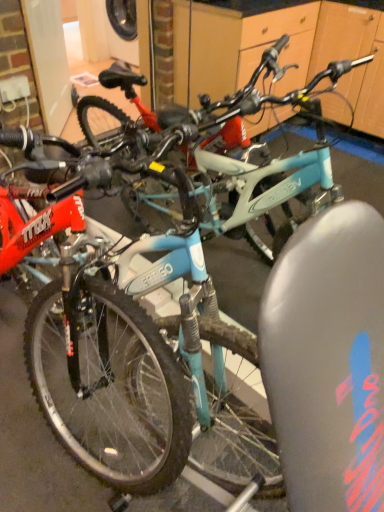
Measure the distance between point (208,167) and camera.

Point (208,167) is 4.97 feet from camera.

This screenshot has height=512, width=384. What do you see at coordinates (216, 155) in the screenshot? I see `matte blue bicycle at center, which ranks as the 2th bicycle in bottom-to-top order` at bounding box center [216, 155].

Find the location of `matte blue bicycle at center, which ranks as the 2th bicycle in bottom-to-top order`. matte blue bicycle at center, which ranks as the 2th bicycle in bottom-to-top order is located at coordinates (216, 155).

This screenshot has height=512, width=384. Find the location of `matte blue bicycle at center, arranged as the 1th bicycle when ordered from the bottom`. matte blue bicycle at center, arranged as the 1th bicycle when ordered from the bottom is located at coordinates 98,357.

What do you see at coordinates (98, 357) in the screenshot?
I see `matte blue bicycle at center, the second bicycle in the top-to-bottom sequence` at bounding box center [98, 357].

Locate an element on the screen. This screenshot has width=384, height=512. matte blue bicycle at center, the first bicycle in the top-to-bottom sequence is located at coordinates (216, 155).

Would you say matte blue bicycle at center, which ranks as the 2th bicycle in bottom-to-top order, is to the left or to the right of matte blue bicycle at center, arranged as the 1th bicycle when ordered from the bottom, in the picture?

matte blue bicycle at center, which ranks as the 2th bicycle in bottom-to-top order, is positioned on matte blue bicycle at center, arranged as the 1th bicycle when ordered from the bottom,'s left side.

Which object is further away from the camera, matte blue bicycle at center, which ranks as the 2th bicycle in bottom-to-top order, or matte blue bicycle at center, the second bicycle in the top-to-bottom sequence?

Positioned behind is matte blue bicycle at center, which ranks as the 2th bicycle in bottom-to-top order.

Does point (327, 192) appear closer or farther from the camera than point (103, 434)?

Point (327, 192).

From the image's perspective, who appears lower, matte blue bicycle at center, which ranks as the 2th bicycle in bottom-to-top order, or matte blue bicycle at center, the second bicycle in the top-to-bottom sequence?

matte blue bicycle at center, the second bicycle in the top-to-bottom sequence, is shown below in the image.

From a real-world perspective, is matte blue bicycle at center, the first bicycle in the top-to-bottom sequence, physically below matte blue bicycle at center, arranged as the 1th bicycle when ordered from the bottom?

No, from a real-world perspective, matte blue bicycle at center, the first bicycle in the top-to-bottom sequence, is not beneath matte blue bicycle at center, arranged as the 1th bicycle when ordered from the bottom.

Which of these two, matte blue bicycle at center, the first bicycle in the top-to-bottom sequence, or matte blue bicycle at center, the second bicycle in the top-to-bottom sequence, is wider?

matte blue bicycle at center, the second bicycle in the top-to-bottom sequence, is wider.

Is matte blue bicycle at center, the first bicycle in the top-to-bottom sequence, shorter than matte blue bicycle at center, the second bicycle in the top-to-bottom sequence?

Correct, matte blue bicycle at center, the first bicycle in the top-to-bottom sequence, is not as tall as matte blue bicycle at center, the second bicycle in the top-to-bottom sequence.

Based on their sizes in the image, would you say matte blue bicycle at center, the first bicycle in the top-to-bottom sequence, is bigger or smaller than matte blue bicycle at center, the second bicycle in the top-to-bottom sequence?

matte blue bicycle at center, the first bicycle in the top-to-bottom sequence, is smaller than matte blue bicycle at center, the second bicycle in the top-to-bottom sequence.

Choose the correct answer: Is matte blue bicycle at center, which ranks as the 2th bicycle in bottom-to-top order, inside matte blue bicycle at center, arranged as the 1th bicycle when ordered from the bottom, or outside it?

matte blue bicycle at center, which ranks as the 2th bicycle in bottom-to-top order, is located beyond the bounds of matte blue bicycle at center, arranged as the 1th bicycle when ordered from the bottom.

Are matte blue bicycle at center, which ranks as the 2th bicycle in bottom-to-top order, and matte blue bicycle at center, arranged as the 1th bicycle when ordered from the bottom, located far from each other?

No, matte blue bicycle at center, which ranks as the 2th bicycle in bottom-to-top order, is in close proximity to matte blue bicycle at center, arranged as the 1th bicycle when ordered from the bottom.

Is matte blue bicycle at center, which ranks as the 2th bicycle in bottom-to-top order, facing away from matte blue bicycle at center, arranged as the 1th bicycle when ordered from the bottom?

matte blue bicycle at center, which ranks as the 2th bicycle in bottom-to-top order, does not have its back to matte blue bicycle at center, arranged as the 1th bicycle when ordered from the bottom.

How many degrees apart are the facing directions of matte blue bicycle at center, the first bicycle in the top-to-bottom sequence, and matte blue bicycle at center, arranged as the 1th bicycle when ordered from the bottom?

1.59 degrees separate the facing orientations of matte blue bicycle at center, the first bicycle in the top-to-bottom sequence, and matte blue bicycle at center, arranged as the 1th bicycle when ordered from the bottom.

Where is `bicycle below the matte blue bicycle at center, which ranks as the 2th bicycle in bottom-to-top order (from the image's perspective)`? The height and width of the screenshot is (512, 384). bicycle below the matte blue bicycle at center, which ranks as the 2th bicycle in bottom-to-top order (from the image's perspective) is located at coordinates pyautogui.click(x=98, y=357).

Is matte blue bicycle at center, the second bicycle in the top-to-bottom sequence, to the left of matte blue bicycle at center, which ranks as the 2th bicycle in bottom-to-top order, from the viewer's perspective?

No.

Between matte blue bicycle at center, arranged as the 1th bicycle when ordered from the bottom, and matte blue bicycle at center, the first bicycle in the top-to-bottom sequence, which one is positioned behind?

matte blue bicycle at center, the first bicycle in the top-to-bottom sequence, is behind.

Does point (187, 419) come behind point (244, 199)?

No, (187, 419) is closer to viewer.

From the image's perspective, who appears lower, matte blue bicycle at center, the second bicycle in the top-to-bottom sequence, or matte blue bicycle at center, the first bicycle in the top-to-bottom sequence?

matte blue bicycle at center, the second bicycle in the top-to-bottom sequence, appears lower in the image.

From a real-world perspective, is matte blue bicycle at center, arranged as the 1th bicycle when ordered from the bottom, located higher than matte blue bicycle at center, the first bicycle in the top-to-bottom sequence?

Incorrect, from a real-world perspective, matte blue bicycle at center, arranged as the 1th bicycle when ordered from the bottom, is lower than matte blue bicycle at center, the first bicycle in the top-to-bottom sequence.

Is matte blue bicycle at center, the second bicycle in the top-to-bottom sequence, wider than matte blue bicycle at center, which ranks as the 2th bicycle in bottom-to-top order?

Yes.

Can you confirm if matte blue bicycle at center, the second bicycle in the top-to-bottom sequence, is shorter than matte blue bicycle at center, the first bicycle in the top-to-bottom sequence?

No, matte blue bicycle at center, the second bicycle in the top-to-bottom sequence, is not shorter than matte blue bicycle at center, the first bicycle in the top-to-bottom sequence.

Does matte blue bicycle at center, the second bicycle in the top-to-bottom sequence, have a larger size compared to matte blue bicycle at center, the first bicycle in the top-to-bottom sequence?

Correct, matte blue bicycle at center, the second bicycle in the top-to-bottom sequence, is larger in size than matte blue bicycle at center, the first bicycle in the top-to-bottom sequence.

Is matte blue bicycle at center, the second bicycle in the top-to-bottom sequence, situated inside matte blue bicycle at center, the first bicycle in the top-to-bottom sequence, or outside?

matte blue bicycle at center, the second bicycle in the top-to-bottom sequence, lies outside matte blue bicycle at center, the first bicycle in the top-to-bottom sequence.

Would you consider matte blue bicycle at center, the second bicycle in the top-to-bottom sequence, to be distant from matte blue bicycle at center, which ranks as the 2th bicycle in bottom-to-top order?

They are positioned close to each other.

Is matte blue bicycle at center, which ranks as the 2th bicycle in bottom-to-top order, at the back of matte blue bicycle at center, the second bicycle in the top-to-bottom sequence?

No, matte blue bicycle at center, the second bicycle in the top-to-bottom sequence,'s orientation is not away from matte blue bicycle at center, which ranks as the 2th bicycle in bottom-to-top order.

In order to click on bicycle behind the matte blue bicycle at center, the second bicycle in the top-to-bottom sequence in this screenshot , I will do `click(216, 155)`.

Where is `bicycle that is behind the matte blue bicycle at center, the second bicycle in the top-to-bottom sequence`? This screenshot has width=384, height=512. bicycle that is behind the matte blue bicycle at center, the second bicycle in the top-to-bottom sequence is located at coordinates (216, 155).

You are a GUI agent. You are given a task and a screenshot of the screen. Output one action in this format:
    pyautogui.click(x=<x>, y=<y>)
    Task: Click on the bicycle that is under the matte blue bicycle at center, which ranks as the 2th bicycle in bottom-to-top order (from a real-world perspective)
    
    Given the screenshot: What is the action you would take?
    pyautogui.click(x=98, y=357)